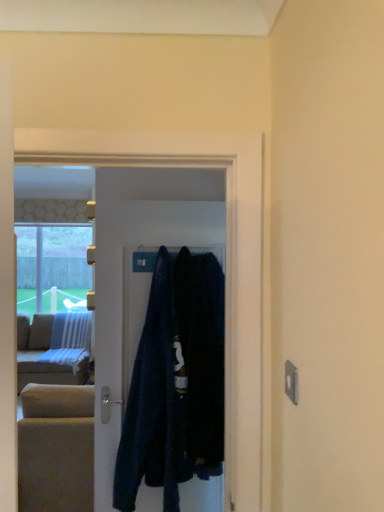
You are a GUI agent. You are given a task and a screenshot of the screen. Output one action in this format:
    pyautogui.click(x=<x>, y=<y>)
    Task: Click on the dark blue fabric coat at center, positioned as the first clothing in right-to-left order
    The image size is (384, 512).
    Given the screenshot: What is the action you would take?
    pyautogui.click(x=202, y=357)

This screenshot has height=512, width=384. What do you see at coordinates (202, 357) in the screenshot?
I see `dark blue fabric coat at center, positioned as the first clothing in right-to-left order` at bounding box center [202, 357].

What do you see at coordinates (153, 402) in the screenshot?
I see `dark blue fabric at center, the 2th clothing in the right-to-left sequence` at bounding box center [153, 402].

In order to click on dark blue fabric coat at center, positioned as the first clothing in right-to-left order in this screenshot , I will do `click(202, 357)`.

From a real-world perspective, between dark blue fabric at center, the 1th clothing viewed from the left, and dark blue fabric coat at center, positioned as the 2th clothing in left-to-right order, who is vertically lower?

In real-world perspective, dark blue fabric at center, the 1th clothing viewed from the left, is lower.

Does dark blue fabric at center, the 2th clothing in the right-to-left sequence, have a greater height compared to dark blue fabric coat at center, positioned as the first clothing in right-to-left order?

Indeed, dark blue fabric at center, the 2th clothing in the right-to-left sequence, has a greater height compared to dark blue fabric coat at center, positioned as the first clothing in right-to-left order.

Is dark blue fabric at center, the 1th clothing viewed from the left, wider or thinner than dark blue fabric coat at center, positioned as the 2th clothing in left-to-right order?

Considering their sizes, dark blue fabric at center, the 1th clothing viewed from the left, looks slimmer than dark blue fabric coat at center, positioned as the 2th clothing in left-to-right order.

Is dark blue fabric at center, the 2th clothing in the right-to-left sequence, to the left of dark blue fabric coat at center, positioned as the 2th clothing in left-to-right order, from the viewer's perspective?

Yes.

Which object is thinner, dark blue fabric coat at center, positioned as the 2th clothing in left-to-right order, or dark blue fabric at center, the 1th clothing viewed from the left?

dark blue fabric at center, the 1th clothing viewed from the left, is thinner.

From the image's perspective, which is above, dark blue fabric coat at center, positioned as the 2th clothing in left-to-right order, or dark blue fabric at center, the 1th clothing viewed from the left?

dark blue fabric coat at center, positioned as the 2th clothing in left-to-right order, appears higher in the image.

Is dark blue fabric coat at center, positioned as the first clothing in right-to-left order, positioned in front of dark blue fabric at center, the 1th clothing viewed from the left?

Yes, dark blue fabric coat at center, positioned as the first clothing in right-to-left order, is closer to the camera.

Does dark blue fabric coat at center, positioned as the first clothing in right-to-left order, have a greater height compared to dark blue fabric at center, the 2th clothing in the right-to-left sequence?

In fact, dark blue fabric coat at center, positioned as the first clothing in right-to-left order, may be shorter than dark blue fabric at center, the 2th clothing in the right-to-left sequence.

Can you confirm if dark blue fabric at center, the 2th clothing in the right-to-left sequence, is positioned to the right of dark blue fabric at center?

Incorrect, dark blue fabric at center, the 2th clothing in the right-to-left sequence, is not on the right side of dark blue fabric at center.

This screenshot has height=512, width=384. What are the coordinates of `clothing that is the 1st object located in front of the dark blue fabric at center` in the screenshot? It's located at (153, 402).

Are dark blue fabric at center, the 1th clothing viewed from the left, and dark blue fabric at center beside each other?

No, dark blue fabric at center, the 1th clothing viewed from the left, is not with dark blue fabric at center.

From a real-world perspective, who is located lower, dark blue fabric at center, the 2th clothing in the right-to-left sequence, or dark blue fabric at center?

dark blue fabric at center, the 2th clothing in the right-to-left sequence, from a real-world perspective.

From a real-world perspective, is dark blue fabric at center positioned under dark blue fabric at center, the 2th clothing in the right-to-left sequence, based on gravity?

No, from a real-world perspective, dark blue fabric at center is not under dark blue fabric at center, the 2th clothing in the right-to-left sequence.

Consider the image. Which object is thinner, dark blue fabric at center or dark blue fabric at center, the 1th clothing viewed from the left?

With smaller width is dark blue fabric at center.

Between dark blue fabric at center and dark blue fabric at center, the 1th clothing viewed from the left, which one appears on the left side from the viewer's perspective?

Positioned to the left is dark blue fabric at center, the 1th clothing viewed from the left.

Locate an element on the screen. the 1st clothing in front of the dark blue fabric at center is located at coordinates (153, 402).

Does dark blue fabric coat at center, positioned as the first clothing in right-to-left order, touch dark blue fabric at center?

dark blue fabric coat at center, positioned as the first clothing in right-to-left order, is not next to dark blue fabric at center, and they're not touching.

Is dark blue fabric at center at the back of dark blue fabric coat at center, positioned as the 2th clothing in left-to-right order?

Yes, dark blue fabric at center is at the back of dark blue fabric coat at center, positioned as the 2th clothing in left-to-right order.

Could you measure the distance between dark blue fabric coat at center, positioned as the 2th clothing in left-to-right order, and dark blue fabric at center?

dark blue fabric coat at center, positioned as the 2th clothing in left-to-right order, and dark blue fabric at center are 11.68 inches apart.

Is dark blue fabric at center further to camera compared to dark blue fabric coat at center, positioned as the 2th clothing in left-to-right order?

Yes, dark blue fabric at center is further from the camera.

This screenshot has width=384, height=512. What are the coordinates of `door behind the dark blue fabric coat at center, positioned as the first clothing in right-to-left order` in the screenshot? It's located at (140, 275).

From the picture: Does dark blue fabric at center have a lesser height compared to dark blue fabric coat at center, positioned as the 2th clothing in left-to-right order?

No.

From the image's perspective, between dark blue fabric at center and dark blue fabric coat at center, positioned as the 2th clothing in left-to-right order, who is located below?

From the image's view, dark blue fabric coat at center, positioned as the 2th clothing in left-to-right order, is below.

You are a GUI agent. You are given a task and a screenshot of the screen. Output one action in this format:
    pyautogui.click(x=<x>, y=<y>)
    Task: Click on the clothing that is above the dark blue fabric at center, the 1th clothing viewed from the left (from a real-world perspective)
    This screenshot has height=512, width=384.
    Given the screenshot: What is the action you would take?
    pyautogui.click(x=202, y=357)

You are a GUI agent. You are given a task and a screenshot of the screen. Output one action in this format:
    pyautogui.click(x=<x>, y=<y>)
    Task: Click on the clothing on the left side of dark blue fabric coat at center, positioned as the first clothing in right-to-left order
    The image size is (384, 512).
    Given the screenshot: What is the action you would take?
    pyautogui.click(x=153, y=402)

Based on their spatial positions, is dark blue fabric at center or dark blue fabric at center, the 1th clothing viewed from the left, further from dark blue fabric coat at center, positioned as the first clothing in right-to-left order?

dark blue fabric at center lies further to dark blue fabric coat at center, positioned as the first clothing in right-to-left order, than the other object.

Looking at this image, from the image, which object appears to be farther from dark blue fabric at center, dark blue fabric coat at center, positioned as the 2th clothing in left-to-right order, or dark blue fabric at center, the 1th clothing viewed from the left?

dark blue fabric coat at center, positioned as the 2th clothing in left-to-right order, is further to dark blue fabric at center.

Looking at this image, from the image, which object appears to be nearer to dark blue fabric at center, the 2th clothing in the right-to-left sequence, dark blue fabric at center or dark blue fabric coat at center, positioned as the first clothing in right-to-left order?

dark blue fabric coat at center, positioned as the first clothing in right-to-left order, lies closer to dark blue fabric at center, the 2th clothing in the right-to-left sequence, than the other object.

Based on their spatial positions, is dark blue fabric coat at center, positioned as the first clothing in right-to-left order, or dark blue fabric at center further from dark blue fabric at center, the 2th clothing in the right-to-left sequence?

Among the two, dark blue fabric at center is located further to dark blue fabric at center, the 2th clothing in the right-to-left sequence.

Based on the photo, based on their spatial positions, is dark blue fabric at center, the 2th clothing in the right-to-left sequence, or dark blue fabric coat at center, positioned as the 2th clothing in left-to-right order, further from dark blue fabric at center?

Among the two, dark blue fabric coat at center, positioned as the 2th clothing in left-to-right order, is located further to dark blue fabric at center.

Based on their spatial positions, is dark blue fabric at center, the 2th clothing in the right-to-left sequence, or dark blue fabric at center further from dark blue fabric coat at center, positioned as the 2th clothing in left-to-right order?

The object further to dark blue fabric coat at center, positioned as the 2th clothing in left-to-right order, is dark blue fabric at center.

This screenshot has width=384, height=512. I want to click on door located between dark blue fabric at center, the 1th clothing viewed from the left, and dark blue fabric coat at center, positioned as the 2th clothing in left-to-right order, in the left-right direction, so click(x=140, y=275).